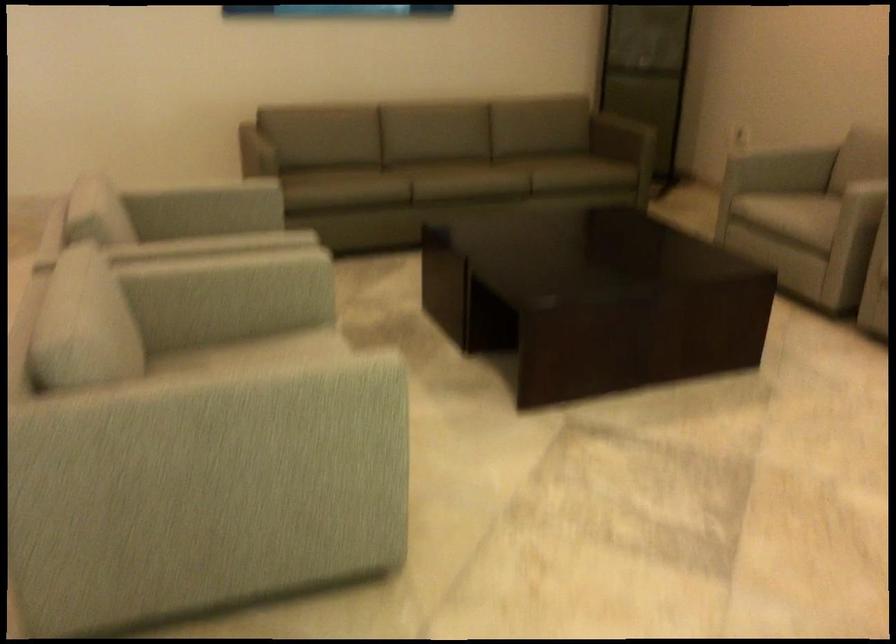
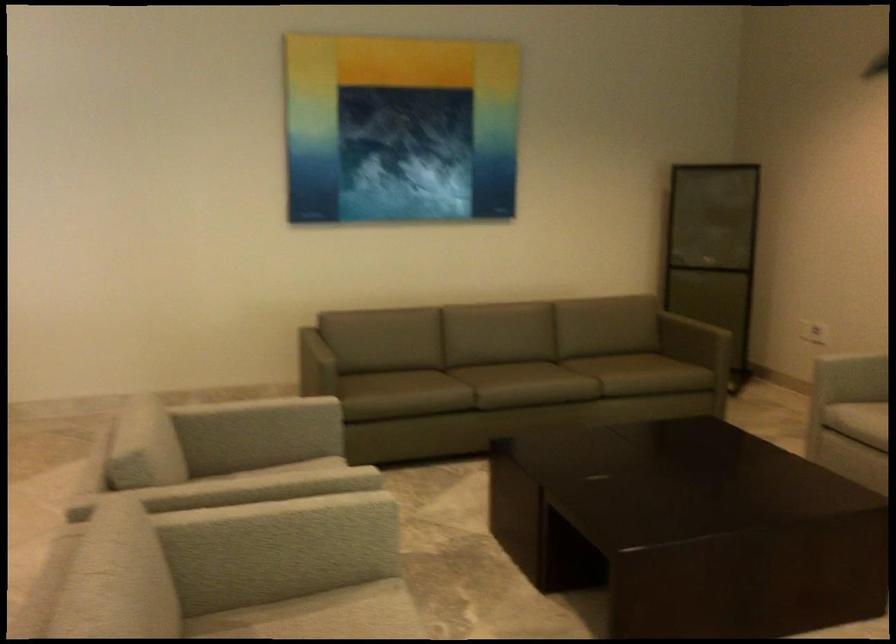
The point at [760,207] is marked in the first image. Where is the corresponding point in the second image?

(857, 420)